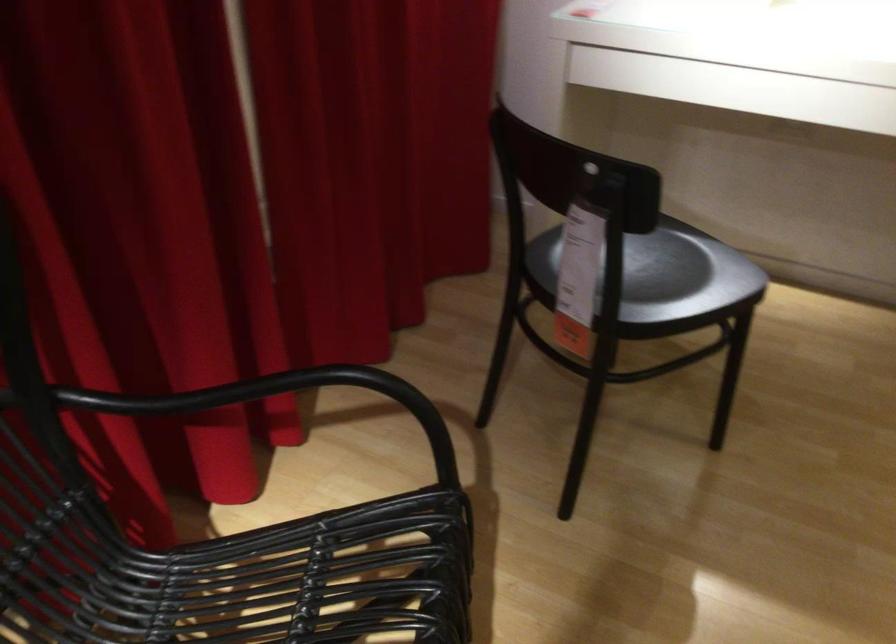
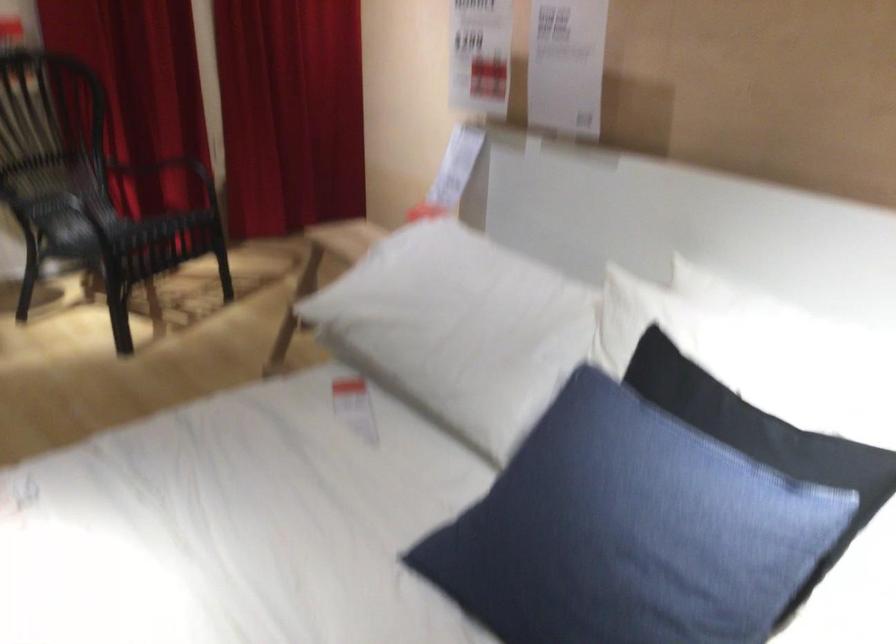
Question: I am providing you with two images of the same scene from different viewpoints. Please identify which objects are invisible in image2.

Choices:
 (A) chair sitting surface
 (B) blue rolling cart
 (C) blue pillow
 (D) black chair armrest

Answer: (D)